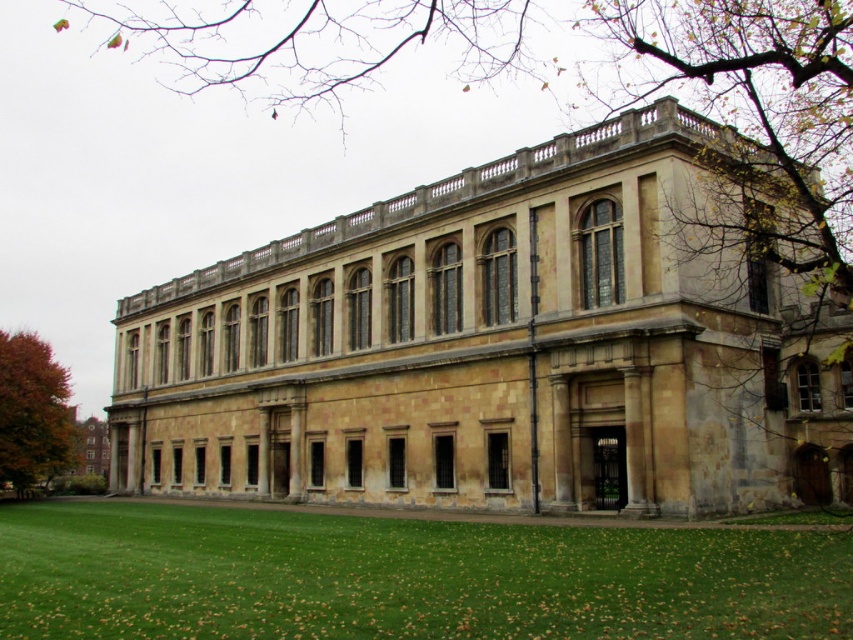
You are standing in front of the grand historic building and want to take a photo of the orange leafy tree at lower left. To ensure the green grass at lower center is visible in the background, where should you position yourself relative to the tree?

You should position yourself to the right of the orange leafy tree at lower left so that the green grass at lower center, which is located below the tree, becomes visible in the background.

Consider the image. You are standing at the point marked as point (498, 348). What is the name of the building you are standing in front of?

The point (498, 348) corresponds to the yellow stone building at center, so you are standing in front of the yellow stone building at center.

You are a landscape architect planning to install a new garden feature between the yellow stone building at center and the green grass at lower center. Considering their relative heights, which object should the garden feature be placed closer to for visibility?

The garden feature should be placed closer to the yellow stone building at center because it is taller than the green grass at lower center, ensuring better visibility from a distance.